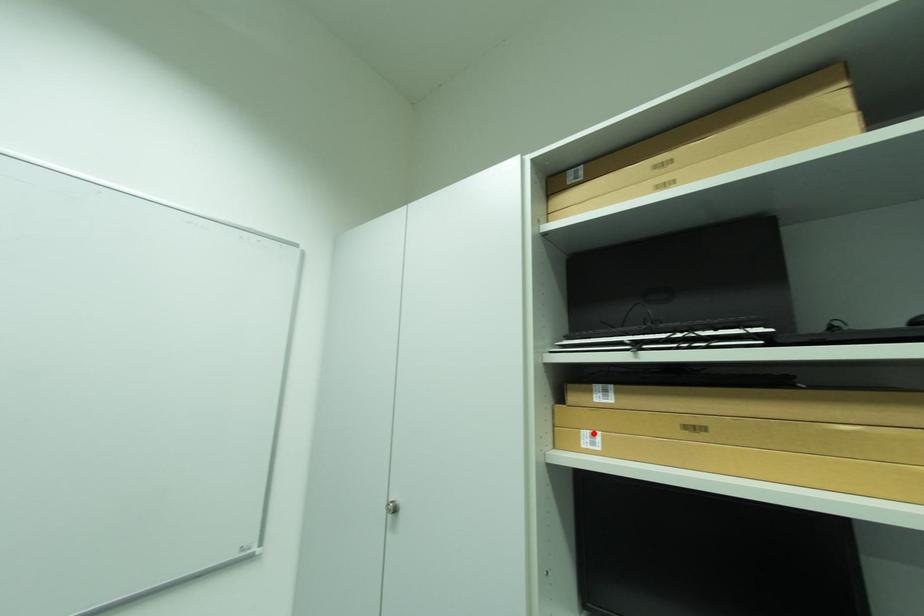
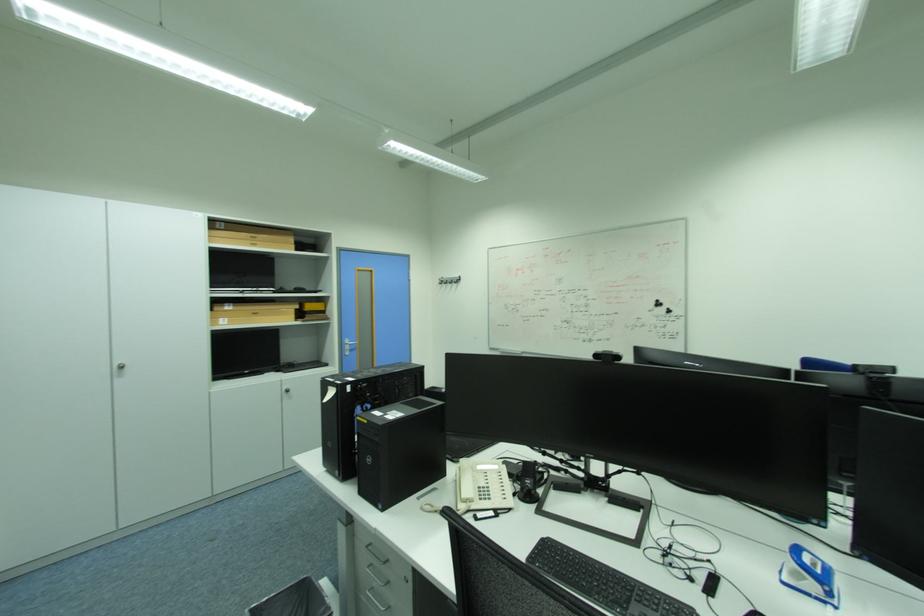
The point at the highlighted location is marked in the first image. Where is the corresponding point in the second image?

(228, 320)